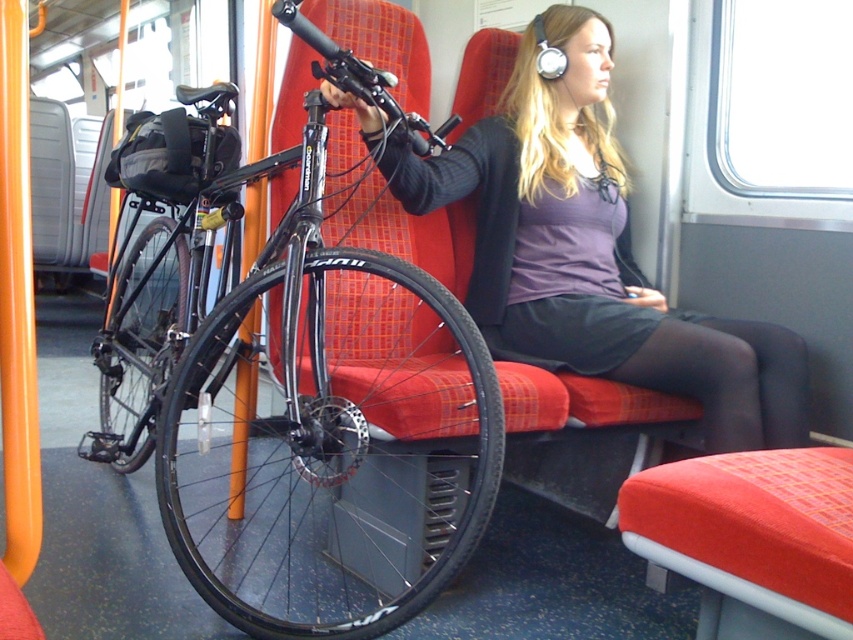
Question: Can you confirm if shiny black bicycle at left is wider than matte black jacket at center?

Choices:
 (A) no
 (B) yes

Answer: (B)

Question: Is shiny black bicycle at left to the right of matte black jacket at center from the viewer's perspective?

Choices:
 (A) no
 (B) yes

Answer: (A)

Question: Among these points, which one is farthest from the camera?

Choices:
 (A) (521, 120)
 (B) (482, 531)

Answer: (A)

Question: Which point appears farthest from the camera in this image?

Choices:
 (A) (720, 445)
 (B) (115, 444)

Answer: (B)

Question: Is shiny black bicycle at left positioned in front of matte black jacket at center?

Choices:
 (A) no
 (B) yes

Answer: (B)